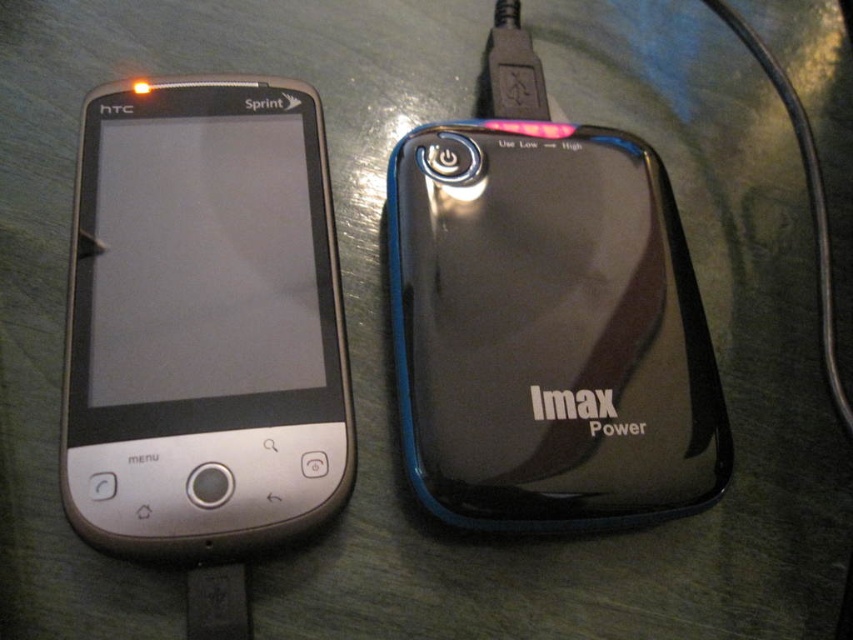
Between silver metallic smartphone at left and black glossy power bank at right, which one is positioned higher?

Positioned higher is silver metallic smartphone at left.

Does point (190, 198) lie in front of point (505, 372)?

No, (190, 198) is behind (505, 372).

Locate an element on the screen. silver metallic smartphone at left is located at coordinates (202, 321).